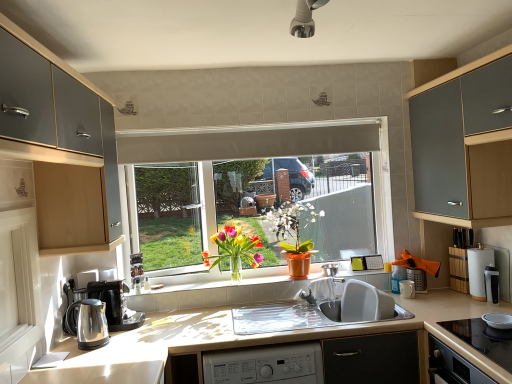
Question: Considering their positions, is matte white window at center located in front of or behind orange matte pot at center, which appears as the second floral arrangement when viewed from the left?

Choices:
 (A) behind
 (B) front

Answer: (A)

Question: Is matte white window at center inside or outside of orange matte pot at center, the 1th floral arrangement viewed from the right?

Choices:
 (A) inside
 (B) outside

Answer: (B)

Question: Estimate the real-world distances between objects in this image. Which object is farther from the polished stainless steel kettle at lower left?

Choices:
 (A) black glass cooktop at lower right
 (B) matte silver utensil holder at right, which is the third appliance in right-to-left order
 (C) metallic silver pot at center, the 5th appliance from the front
 (D) brushed metal cabinet at left, positioned as the first cabinetry in left-to-right order
 (E) black ceramic bowl at lower right, the 4th appliance from the left

Answer: (E)

Question: Which object is positioned farthest from the black glass cooktop at lower right?

Choices:
 (A) white paper towel at right, arranged as the 5th appliance when viewed from the left
 (B) white glossy screen door at left
 (C) white ceramic mug at right, the 3th appliance in the back-to-front sequence
 (D) white tile at center
 (E) brushed metal cabinet at left, the second cabinetry positioned from the right

Answer: (B)